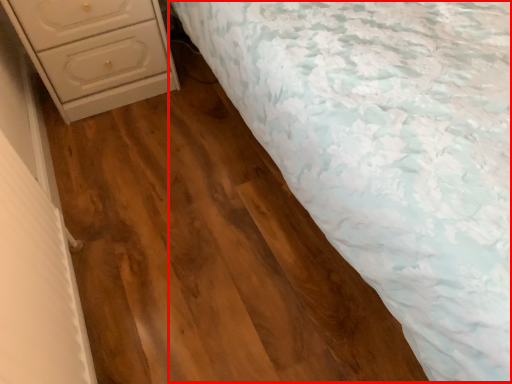
Question: Observing the image, what is the correct spatial positioning of bed (annotated by the red box) in reference to chest of drawers?

Choices:
 (A) right
 (B) left

Answer: (A)